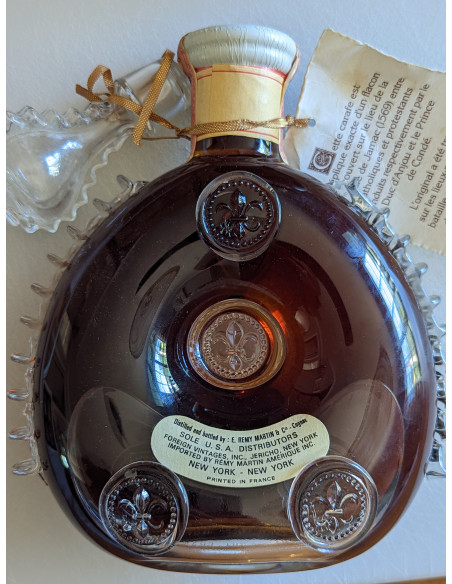
Identify the location of plate. (228, 434).